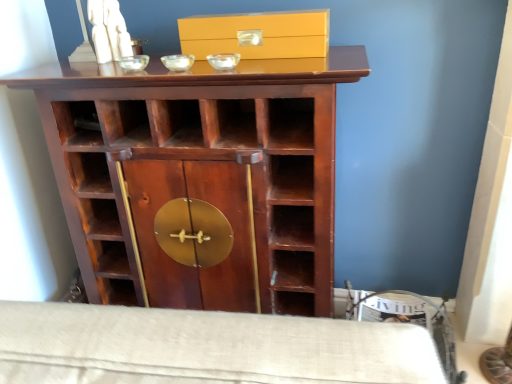
Question: From the image's perspective, relative to matte yellow box at center, is mahogany wood cupboard at center above or below?

Choices:
 (A) below
 (B) above

Answer: (A)

Question: Is mahogany wood cupboard at center bigger or smaller than matte yellow box at center?

Choices:
 (A) big
 (B) small

Answer: (A)

Question: In terms of width, does mahogany wood cupboard at center look wider or thinner when compared to matte yellow box at center?

Choices:
 (A) wide
 (B) thin

Answer: (A)

Question: Considering the positions of matte yellow box at center and mahogany wood cupboard at center in the image, is matte yellow box at center taller or shorter than mahogany wood cupboard at center?

Choices:
 (A) tall
 (B) short

Answer: (B)

Question: Is matte yellow box at center bigger or smaller than mahogany wood cupboard at center?

Choices:
 (A) big
 (B) small

Answer: (B)

Question: From a real-world perspective, relative to mahogany wood cupboard at center, is matte yellow box at center vertically above or below?

Choices:
 (A) above
 (B) below

Answer: (A)

Question: Is point (312, 13) closer or farther from the camera than point (150, 243)?

Choices:
 (A) closer
 (B) farther

Answer: (A)